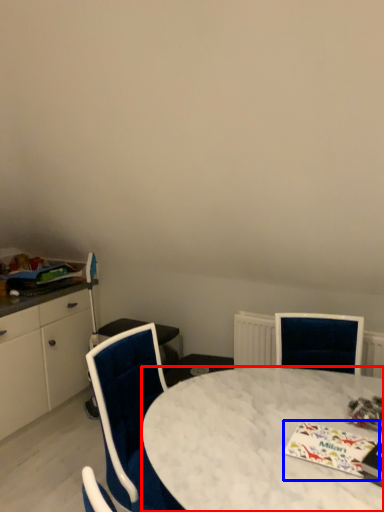
Question: Which point is closer to the camera, desk (highlighted by a red box) or magazine (highlighted by a blue box)?

Choices:
 (A) desk
 (B) magazine

Answer: (A)